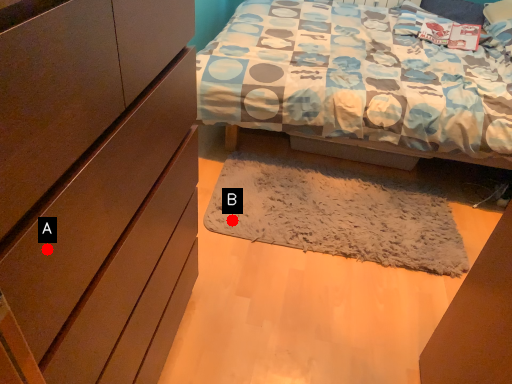
Question: Two points are circled on the image, labeled by A and B beside each circle. Which point is closer to the camera taking this photo?

Choices:
 (A) A is closer
 (B) B is closer

Answer: (A)